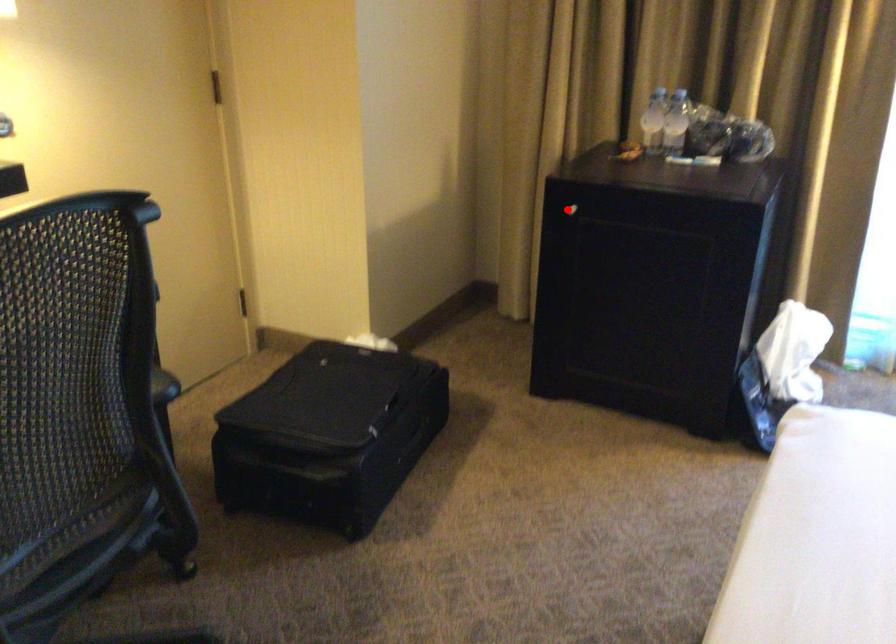
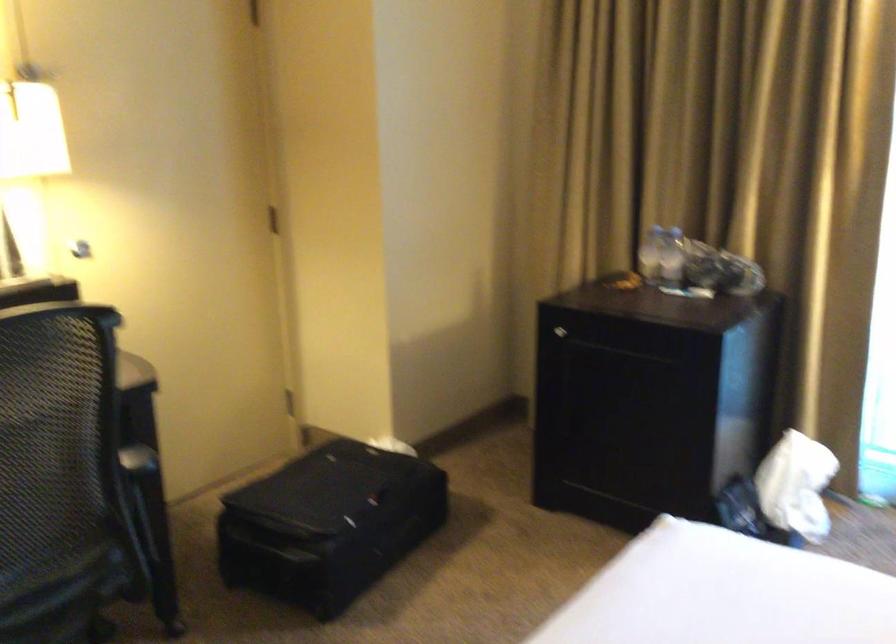
Locate, in the second image, the point that corresponds to the highlighted location in the first image.

(560, 330)